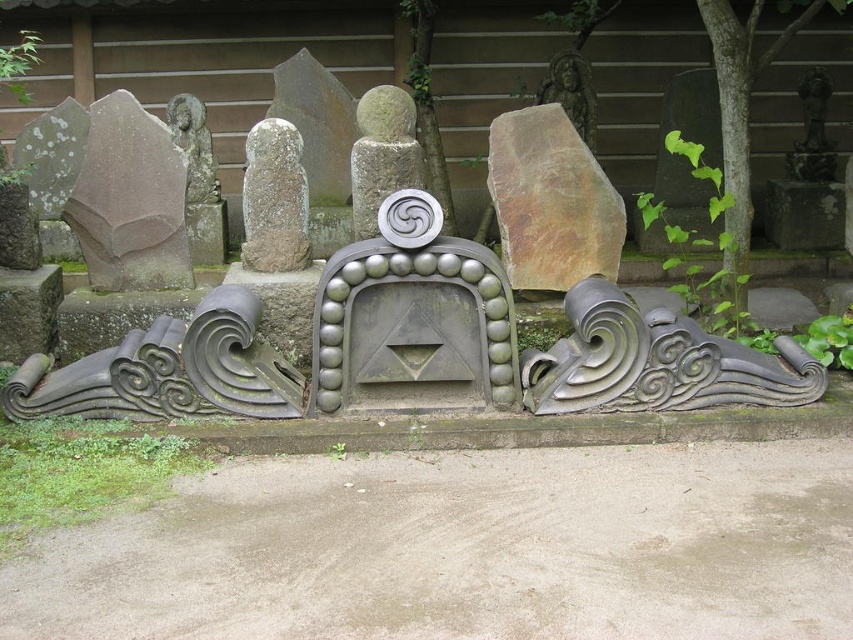
You are an architect designing a garden layout. You have two statues to place in the garden. The gray stone statue at center and the green stone statue at upper left. Given their sizes, which statue should be placed closer to visitors to ensure visibility?

The gray stone statue at center has a larger width than the green stone statue at upper left, so it should be placed closer to visitors to ensure visibility.

You are an architect designing a new garden and want to place a decorative stone exactly at the center of a circular pond. The pond has a radius of 1 meter. You have the smooth gray stone at center from the image. Can you determine if placing it at the specified coordinates will keep it centered within the pond?

The smooth gray stone at center is positioned at point (381, 154), which is within the 1 meter radius of the pond. Therefore, placing it there will keep it centered within the pond.